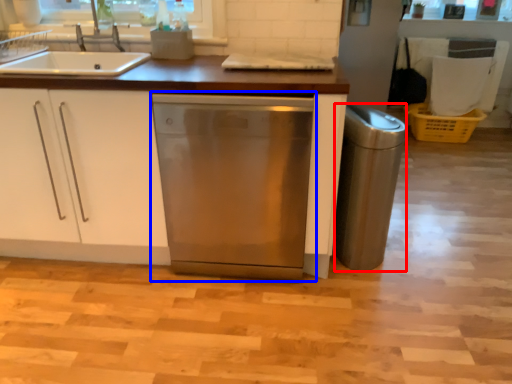
Question: Which point is closer to the camera, appliance (highlighted by a red box) or home appliance (highlighted by a blue box)?

Choices:
 (A) appliance
 (B) home appliance

Answer: (B)